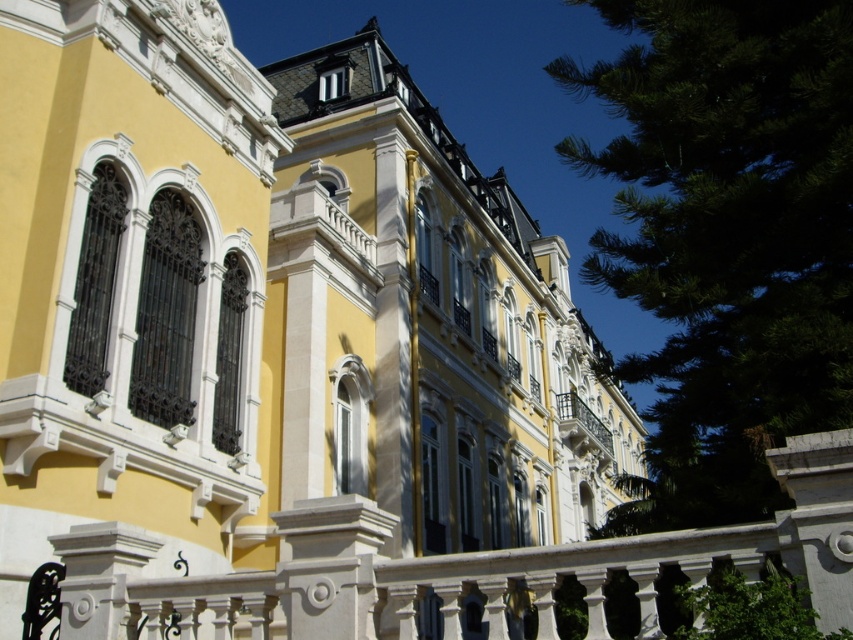
Can you confirm if green leafy tree at upper right is thinner than white wrought iron balcony at center?

No, green leafy tree at upper right is not thinner than white wrought iron balcony at center.

Between green leafy tree at upper right and white wrought iron balcony at center, which one appears on the right side from the viewer's perspective?

green leafy tree at upper right

Describe the element at coordinates (726, 237) in the screenshot. This screenshot has height=640, width=853. I see `green leafy tree at upper right` at that location.

At what (x,y) coordinates should I click in order to perform the action: click on green leafy tree at upper right. Please return your answer as a coordinate pair (x, y). The height and width of the screenshot is (640, 853). Looking at the image, I should click on (726, 237).